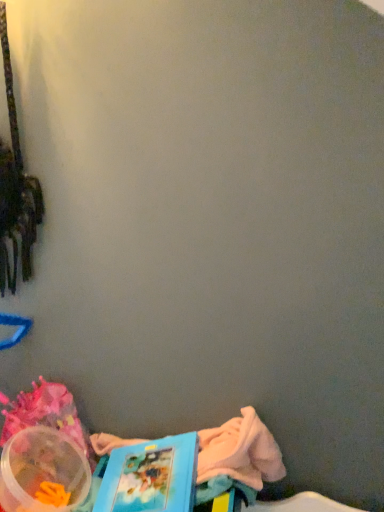
Locate an element on the screen. The height and width of the screenshot is (512, 384). blue cardboard book at lower left is located at coordinates (151, 477).

Describe the element at coordinates (151, 477) in the screenshot. I see `blue cardboard book at lower left` at that location.

What do you see at coordinates (43, 472) in the screenshot? I see `translucent plastic container at lower left` at bounding box center [43, 472].

Locate an element on the screen. The image size is (384, 512). translucent plastic container at lower left is located at coordinates (43, 472).

Find the location of a particular element. The height and width of the screenshot is (512, 384). blue cardboard book at lower left is located at coordinates (151, 477).

Which object is positioned more to the left, translucent plastic container at lower left or blue cardboard book at lower left?

translucent plastic container at lower left.

In the scene shown: Considering the relative positions of translucent plastic container at lower left and blue cardboard book at lower left in the image provided, is translucent plastic container at lower left in front of blue cardboard book at lower left?

That is False.

Which is less distant, (50, 472) or (195, 467)?

Point (195, 467)

From the image's perspective, who appears lower, translucent plastic container at lower left or blue cardboard book at lower left?

translucent plastic container at lower left appears lower in the image.

From a real-world perspective, is translucent plastic container at lower left physically above blue cardboard book at lower left?

Incorrect, from a real-world perspective, translucent plastic container at lower left is lower than blue cardboard book at lower left.

Considering the sizes of objects translucent plastic container at lower left and blue cardboard book at lower left in the image provided, who is wider, translucent plastic container at lower left or blue cardboard book at lower left?

blue cardboard book at lower left is wider.

Does translucent plastic container at lower left have a greater height compared to blue cardboard book at lower left?

No.

Does translucent plastic container at lower left have a larger size compared to blue cardboard book at lower left?

Incorrect, translucent plastic container at lower left is not larger than blue cardboard book at lower left.

Can blue cardboard book at lower left be found inside translucent plastic container at lower left?

Actually, blue cardboard book at lower left is outside translucent plastic container at lower left.

Is translucent plastic container at lower left not close to blue cardboard book at lower left?

That's not correct — translucent plastic container at lower left is a little close to blue cardboard book at lower left.

Is translucent plastic container at lower left aimed at blue cardboard book at lower left?

No, translucent plastic container at lower left is not facing towards blue cardboard book at lower left.

Locate an element on the screen. storage box below the blue cardboard book at lower left (from the image's perspective) is located at coordinates (43, 472).

Does blue cardboard book at lower left appear on the left side of translucent plastic container at lower left?

In fact, blue cardboard book at lower left is to the right of translucent plastic container at lower left.

Considering the relative positions of blue cardboard book at lower left and translucent plastic container at lower left in the image provided, is blue cardboard book at lower left in front of translucent plastic container at lower left?

Yes, it is.

Which is further, (x=174, y=442) or (x=49, y=436)?

The point (x=49, y=436) is more distant.

From the image's perspective, between blue cardboard book at lower left and translucent plastic container at lower left, who is located below?

From the image's view, translucent plastic container at lower left is below.

From a real-world perspective, is blue cardboard book at lower left located higher than translucent plastic container at lower left?

Yes.

In terms of width, does blue cardboard book at lower left look wider or thinner when compared to translucent plastic container at lower left?

blue cardboard book at lower left is wider than translucent plastic container at lower left.

Considering the sizes of blue cardboard book at lower left and translucent plastic container at lower left in the image, is blue cardboard book at lower left taller or shorter than translucent plastic container at lower left?

Clearly, blue cardboard book at lower left is taller compared to translucent plastic container at lower left.

Does blue cardboard book at lower left have a smaller size compared to translucent plastic container at lower left?

Actually, blue cardboard book at lower left might be larger than translucent plastic container at lower left.

Would you say blue cardboard book at lower left is outside translucent plastic container at lower left?

Yes, blue cardboard book at lower left is located beyond the bounds of translucent plastic container at lower left.

Is blue cardboard book at lower left far from translucent plastic container at lower left?

No.

Is blue cardboard book at lower left looking in the opposite direction of translucent plastic container at lower left?

That's not correct — blue cardboard book at lower left is not looking away from translucent plastic container at lower left.

How different are the orientations of blue cardboard book at lower left and translucent plastic container at lower left in degrees?

blue cardboard book at lower left and translucent plastic container at lower left are facing 5.64 degrees away from each other.

How much distance is there between blue cardboard book at lower left and translucent plastic container at lower left?

6.85 inches.

There is a translucent plastic container at lower left. Where is `book above it (from a real-world perspective)`? This screenshot has width=384, height=512. book above it (from a real-world perspective) is located at coordinates (151, 477).

Locate an element on the screen. The height and width of the screenshot is (512, 384). storage box located underneath the blue cardboard book at lower left (from a real-world perspective) is located at coordinates (43, 472).

Locate an element on the screen. book on the right of translucent plastic container at lower left is located at coordinates (151, 477).